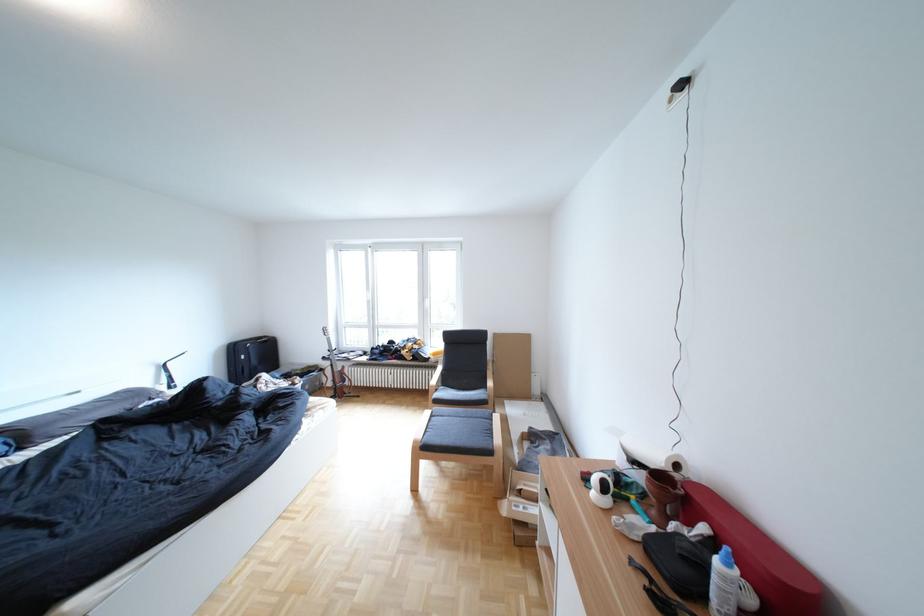
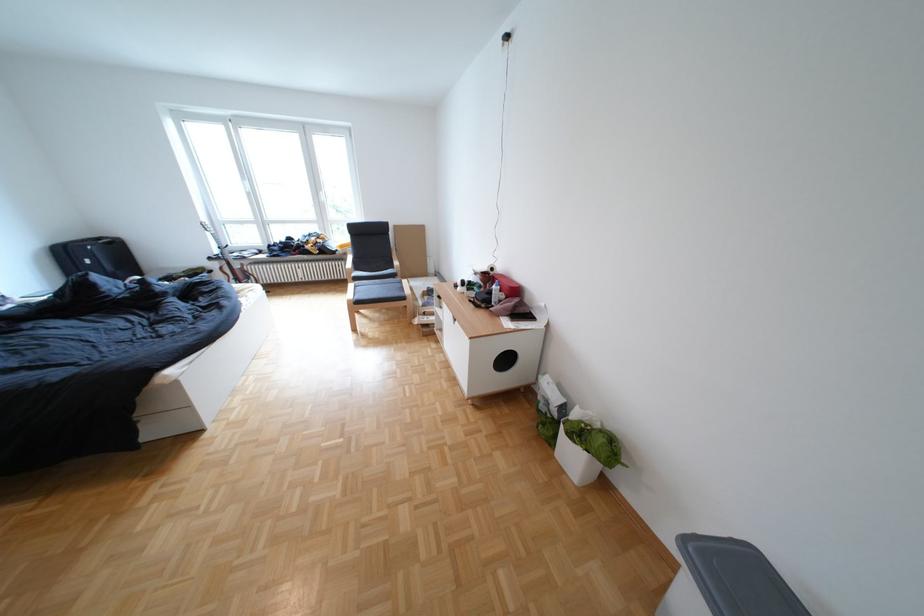
Find the pixel in the second image that matches (x=699, y=557) in the first image.

(503, 294)